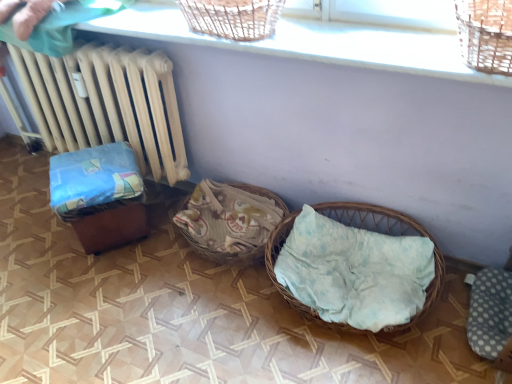
Question: From the image's perspective, is beige wood radiator at left below wooden brown baby carriage at left?

Choices:
 (A) no
 (B) yes

Answer: (A)

Question: Does beige wood radiator at left have a lesser height compared to wooden brown baby carriage at left?

Choices:
 (A) yes
 (B) no

Answer: (B)

Question: Is the depth of beige wood radiator at left less than that of wooden brown baby carriage at left?

Choices:
 (A) no
 (B) yes

Answer: (B)

Question: Is beige wood radiator at left positioned far away from wooden brown baby carriage at left?

Choices:
 (A) no
 (B) yes

Answer: (A)

Question: Can you confirm if beige wood radiator at left is positioned to the left of wooden brown baby carriage at left?

Choices:
 (A) yes
 (B) no

Answer: (A)

Question: Is beige wood radiator at left wider than wooden brown baby carriage at left?

Choices:
 (A) yes
 (B) no

Answer: (B)

Question: Can you confirm if woven wicker basket at lower right is smaller than woven wood basket at upper center?

Choices:
 (A) yes
 (B) no

Answer: (B)

Question: From the image's perspective, is woven wicker basket at lower right located beneath woven wood basket at upper center?

Choices:
 (A) no
 (B) yes

Answer: (B)

Question: Can you confirm if woven wicker basket at lower right is positioned to the right of woven wood basket at upper center?

Choices:
 (A) yes
 (B) no

Answer: (A)

Question: From a real-world perspective, is woven wicker basket at lower right physically below woven wood basket at upper center?

Choices:
 (A) yes
 (B) no

Answer: (A)

Question: Is woven wicker basket at lower right thinner than woven wood basket at upper center?

Choices:
 (A) no
 (B) yes

Answer: (A)

Question: Is woven wicker basket at lower right closer to camera compared to woven wood basket at upper center?

Choices:
 (A) no
 (B) yes

Answer: (A)

Question: Is woven wicker basket at lower right located outside wooden brown baby carriage at left?

Choices:
 (A) no
 (B) yes

Answer: (B)